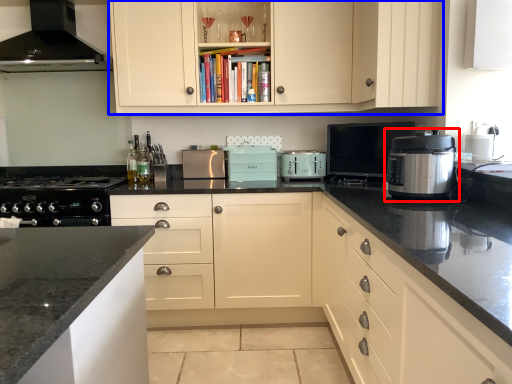
Question: Which of the following is the closest to the observer, kitchen appliance (highlighted by a red box) or cabinetry (highlighted by a blue box)?

Choices:
 (A) kitchen appliance
 (B) cabinetry

Answer: (A)